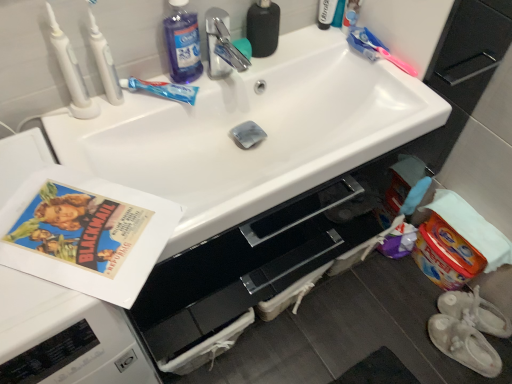
The height and width of the screenshot is (384, 512). I want to click on free location to the left of white fabric slipper at lower right, the second footwear from the back, so click(409, 342).